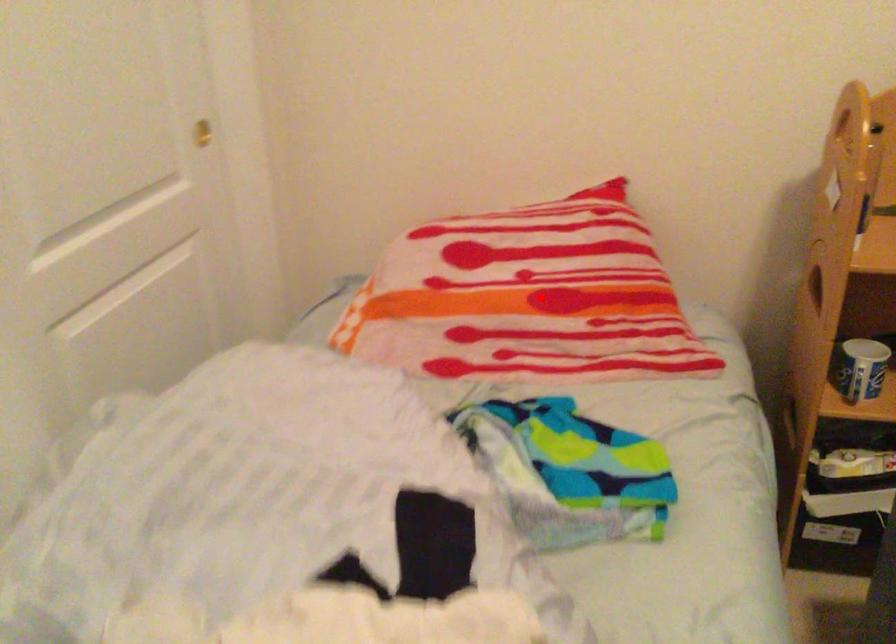
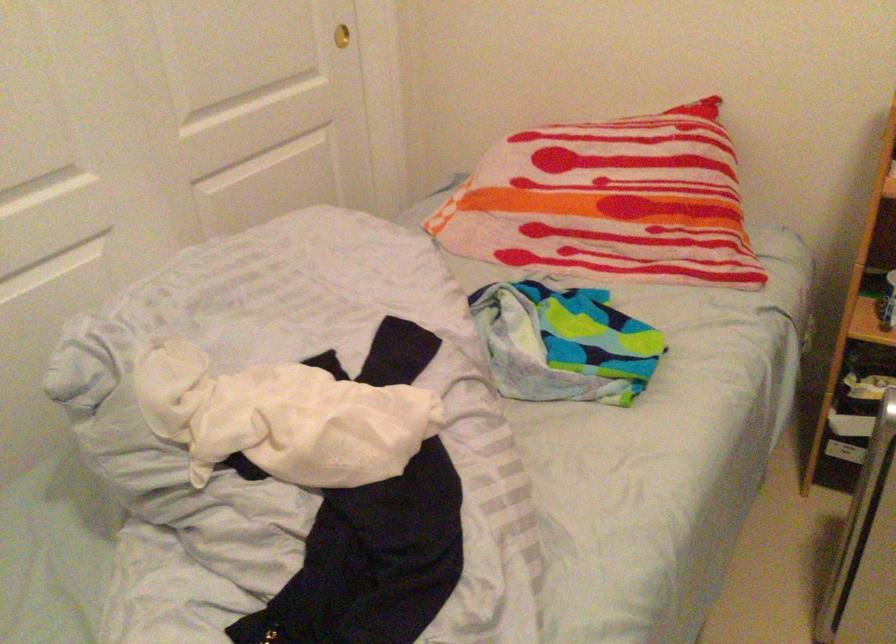
In the second image, find the point that corresponds to the highlighted location in the first image.

(608, 202)